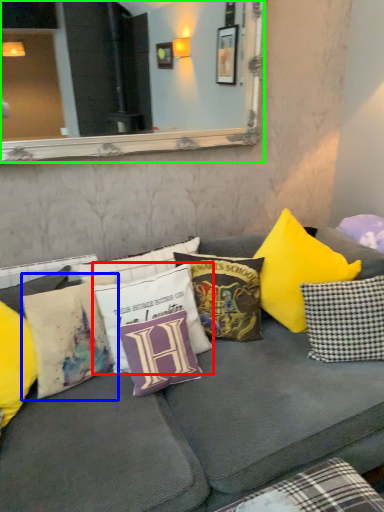
Question: Which is nearer to the pillow (highlighted by a red box)? pillow (highlighted by a blue box) or mirror (highlighted by a green box).

Choices:
 (A) pillow
 (B) mirror

Answer: (A)